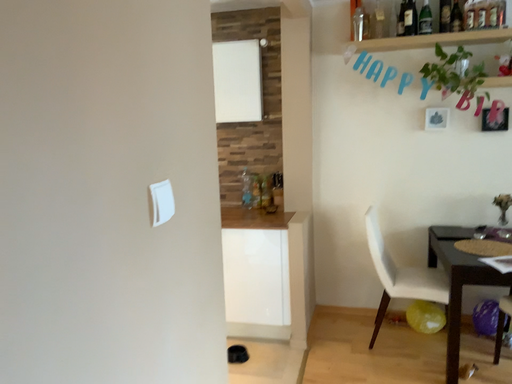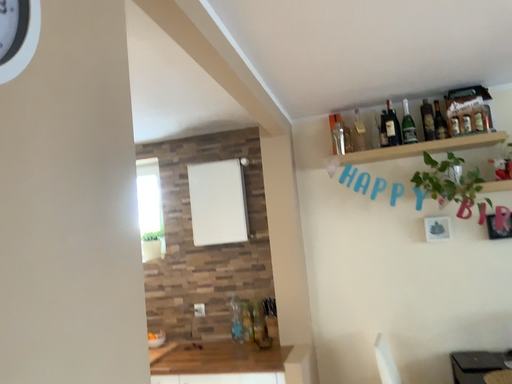
Question: Which way did the camera rotate in the video?

Choices:
 (A) rotated upward
 (B) rotated downward

Answer: (A)